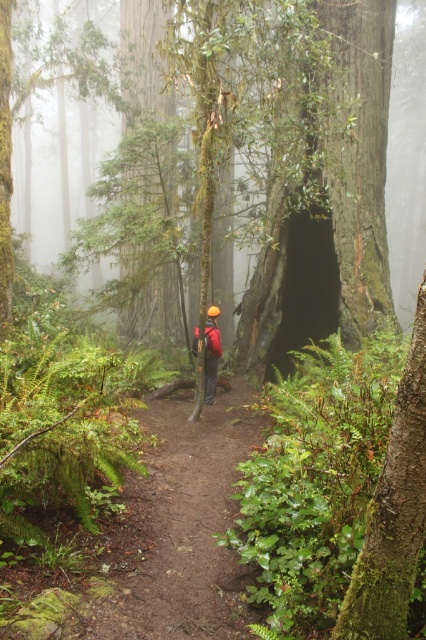
Is brown dirt path at center shorter than red fabric backpack at center?

Correct, brown dirt path at center is not as tall as red fabric backpack at center.

Between brown dirt path at center and red fabric backpack at center, which one has less height?

With less height is brown dirt path at center.

Does point (164, 406) come closer to viewer compared to point (207, 372)?

Yes, point (164, 406) is in front of point (207, 372).

Identify the location of brown dirt path at center. (176, 531).